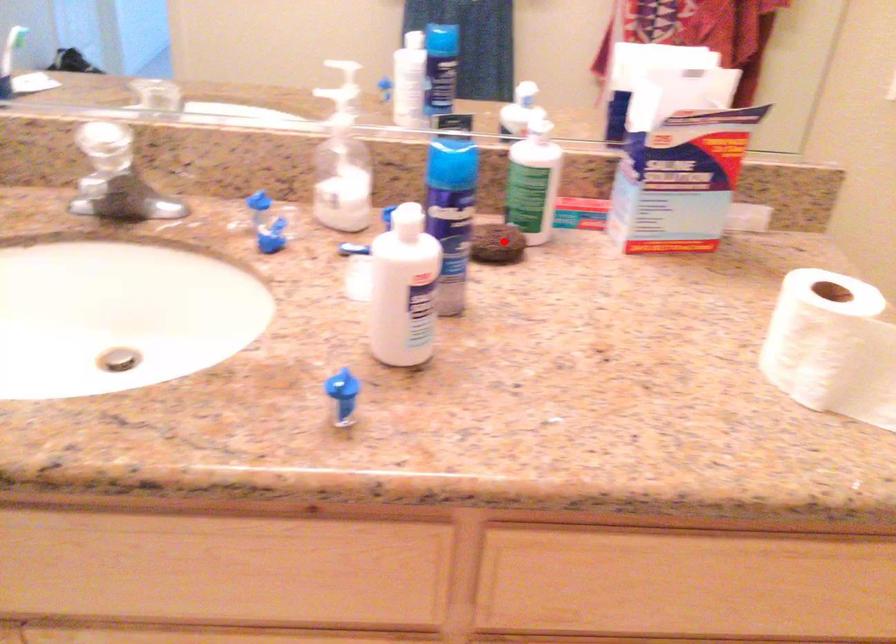
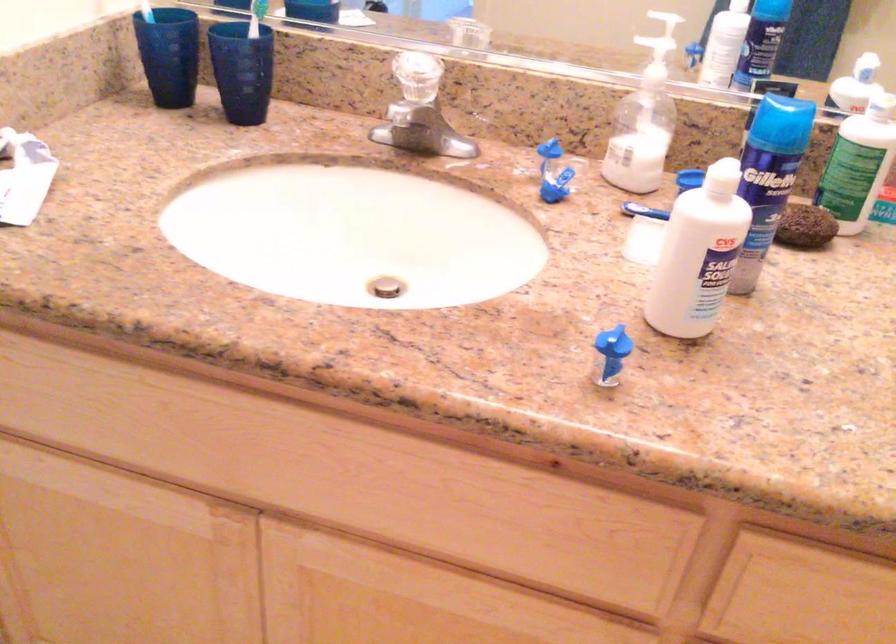
Question: I am providing you with two images of the same scene from different viewpoints. A red point is shown in image1. For the corresponding object point in image2, is it positioned nearer or farther from the camera?

Choices:
 (A) Nearer
 (B) Farther

Answer: (A)